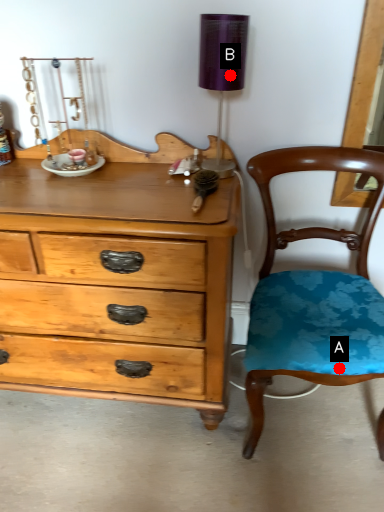
Question: Two points are circled on the image, labeled by A and B beside each circle. Which point appears closest to the camera in this image?

Choices:
 (A) A is closer
 (B) B is closer

Answer: (A)